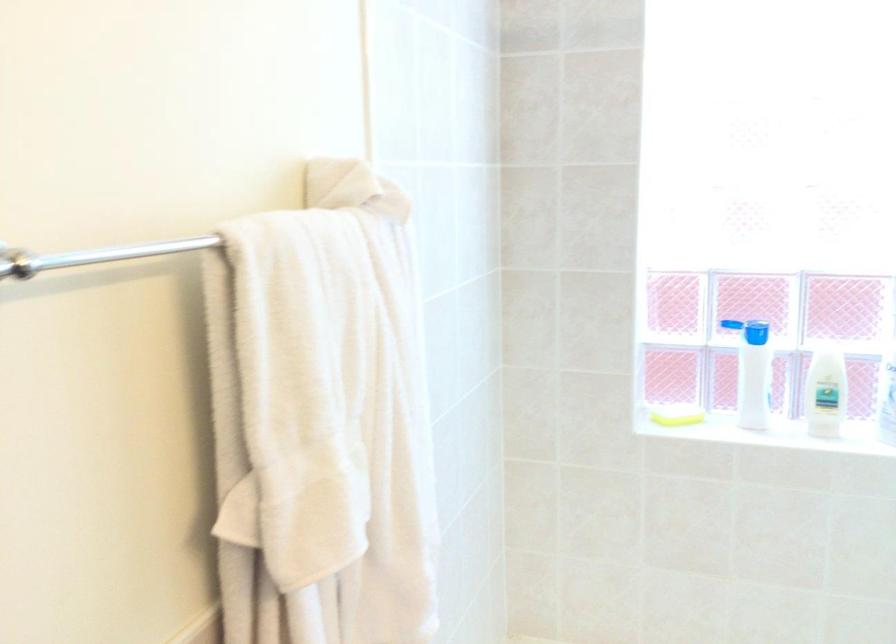
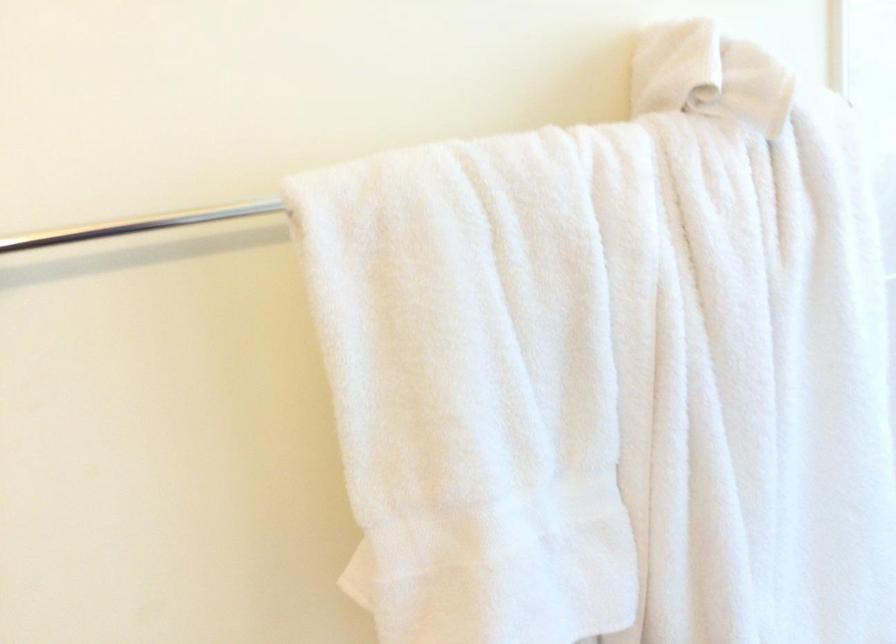
Question: The camera is either moving clockwise (left) or counter-clockwise (right) around the object. The first image is from the beginning of the video and the second image is from the end. Is the camera moving left or right when shooting the video?

Choices:
 (A) Left
 (B) Right

Answer: (B)